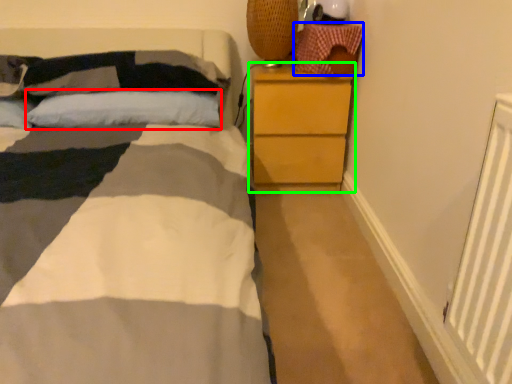
Question: Which object is positioned farthest from pillow (highlighted by a red box)? Select from material (highlighted by a blue box) and chest of drawers (highlighted by a green box).

Choices:
 (A) material
 (B) chest of drawers

Answer: (A)